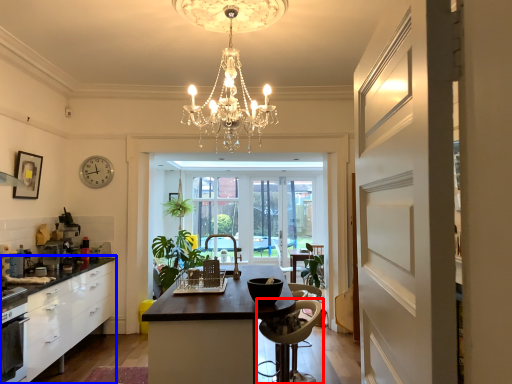
Question: Which object is further to the camera taking this photo, chair (highlighted by a red box) or cabinetry (highlighted by a blue box)?

Choices:
 (A) chair
 (B) cabinetry

Answer: (B)